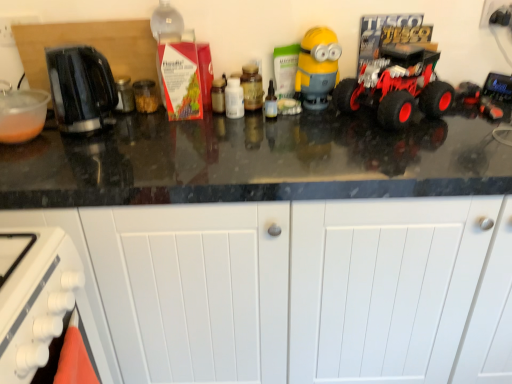
Where is `free space in front of matte brown jar at center, placed as the 2th bottle when sorted from left to right`? The height and width of the screenshot is (384, 512). free space in front of matte brown jar at center, placed as the 2th bottle when sorted from left to right is located at coordinates (242, 130).